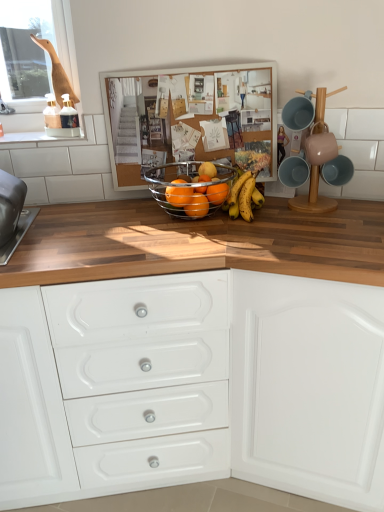
Question: In the image, is orange matte at center positioned in front of or behind white matte cabinet at center?

Choices:
 (A) front
 (B) behind

Answer: (B)

Question: In terms of width, does orange matte at center look wider or thinner when compared to white matte cabinet at center?

Choices:
 (A) wide
 (B) thin

Answer: (B)

Question: Estimate the real-world distances between objects in this image. Which object is closer to the matte blue cup at upper right?

Choices:
 (A) glossy orange at center, the 2th orange in the right-to-left sequence
 (B) glossy metallic fruit basket at center, acting as the fourth orange starting from the right
 (C) yellow matte bananas at center
 (D) glossy orange at center, which is the fourth orange in left-to-right order
 (E) orange matte at center

Answer: (C)

Question: Estimate the real-world distances between objects in this image. Which object is farther from the metallic orange fruit at center, the 3th orange from the right?

Choices:
 (A) glossy metallic fruit basket at center, marked as the 1th orange in a left-to-right arrangement
 (B) orange matte at center
 (C) glossy orange at center, acting as the third orange starting from the left
 (D) yellow matte bananas at center
 (E) matte blue cup at upper right

Answer: (E)